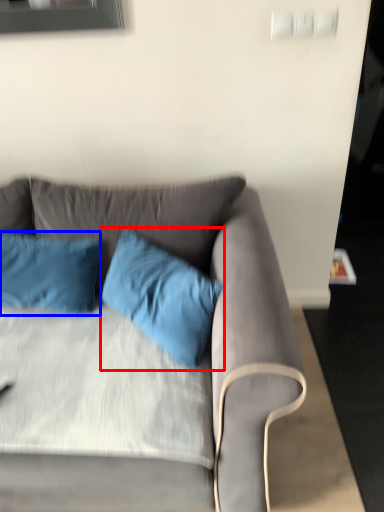
Question: Which object is closer to the camera taking this photo, pillow (highlighted by a red box) or pillow (highlighted by a blue box)?

Choices:
 (A) pillow
 (B) pillow

Answer: (A)